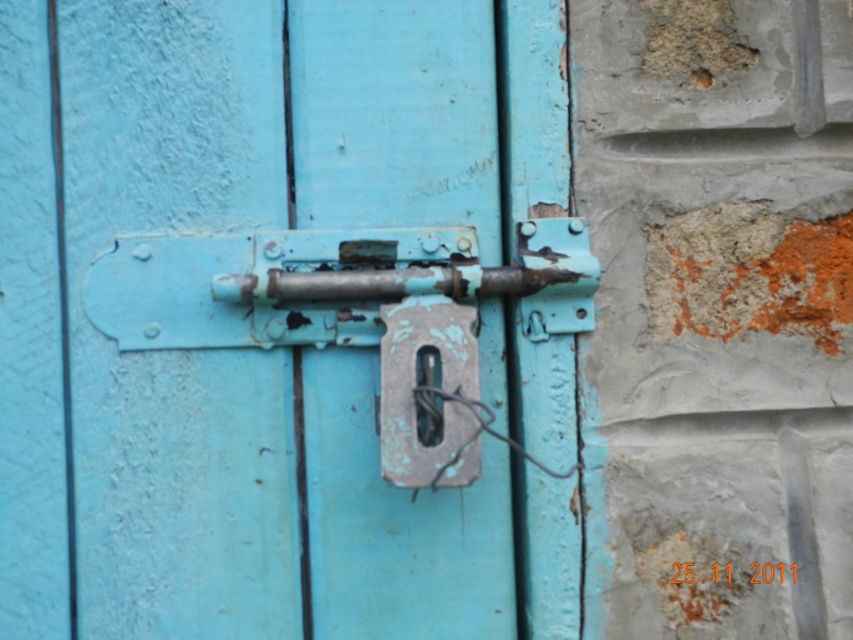
Question: Which point appears closest to the camera in this image?

Choices:
 (A) (264, 460)
 (B) (409, 352)

Answer: (B)

Question: Is rusty metal lock at center to the right of rusty metal padlock at center from the viewer's perspective?

Choices:
 (A) no
 (B) yes

Answer: (A)

Question: Is rusty metal lock at center smaller than rusty metal padlock at center?

Choices:
 (A) yes
 (B) no

Answer: (B)

Question: Does rusty metal lock at center have a larger size compared to rusty metal padlock at center?

Choices:
 (A) yes
 (B) no

Answer: (A)

Question: Which of the following is the closest to the observer?

Choices:
 (A) (389, 429)
 (B) (386, 113)

Answer: (A)